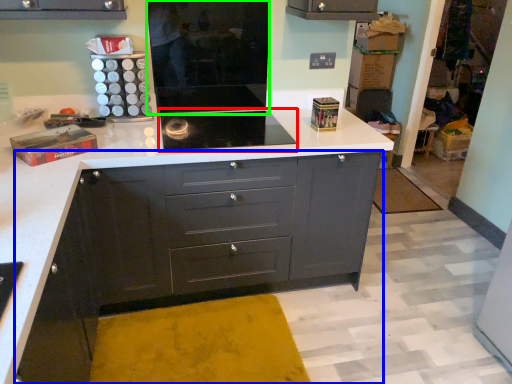
Question: Based on their relative distances, which object is nearer to home appliance (highlighted by a red box)? Choose from chest of drawers (highlighted by a blue box) and appliance (highlighted by a green box).

Choices:
 (A) chest of drawers
 (B) appliance

Answer: (B)